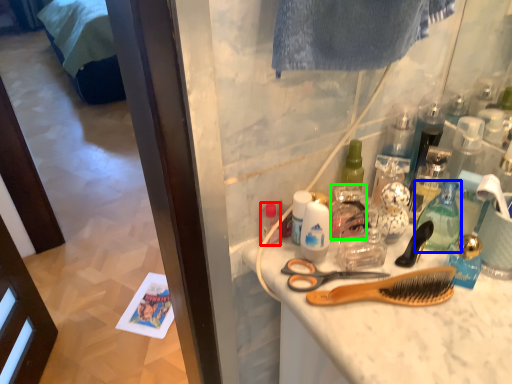
Question: Which is farther away from toiletry (highlighted by a red box)? bottle (highlighted by a blue box) or cleaning product (highlighted by a green box)?

Choices:
 (A) bottle
 (B) cleaning product

Answer: (A)